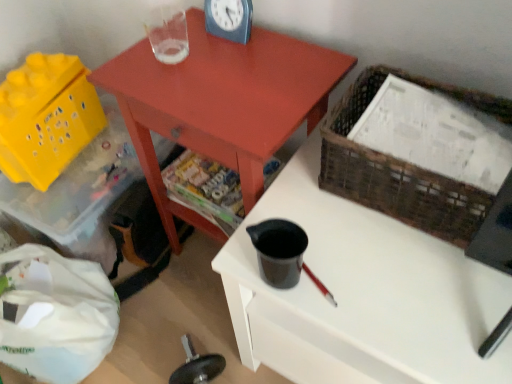
At what (x,y) coordinates should I click in order to perform the action: click on empty space that is ontop of black plastic cup at center (from a real-world perspective). Please return your answer as a coordinate pair (x, y). The width and height of the screenshot is (512, 384). Looking at the image, I should click on (399, 268).